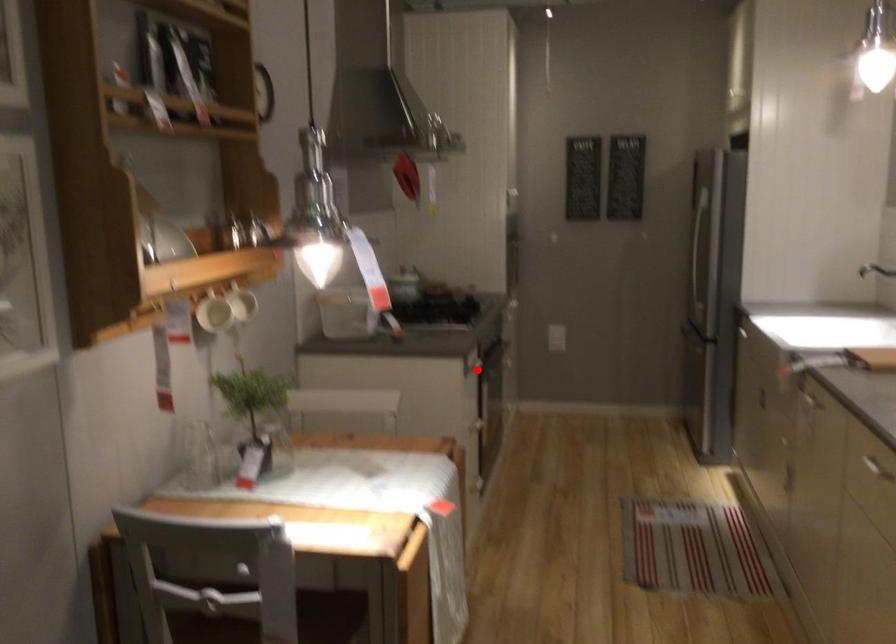
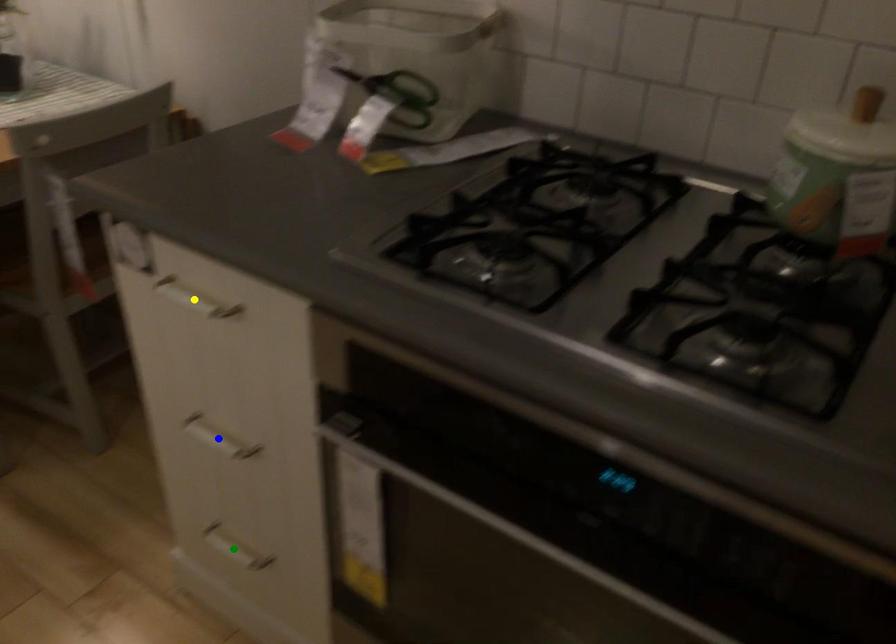
Question: I am providing you with two images of the same scene from different viewpoints. A red point is marked on the first image. You are given multiple points on the second image. Which point in image 2 is actually the same real-world point as the red point in image 1?

Choices:
 (A) blue point
 (B) green point
 (C) yellow point

Answer: (C)